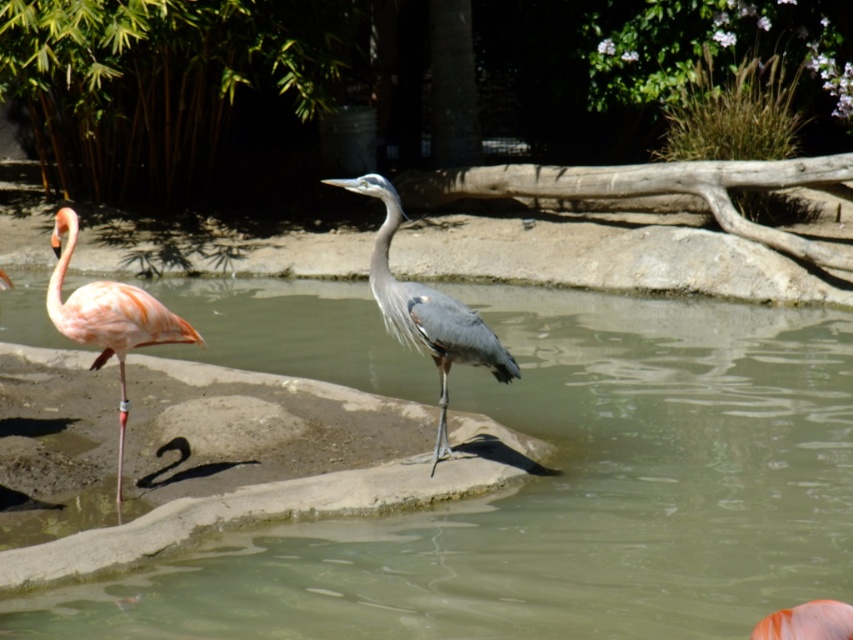
Question: Estimate the real-world distances between objects in this image. Which object is closer to the greenish water at center?

Choices:
 (A) gray matte heron at center
 (B) pink feathered flamingo at left

Answer: (A)

Question: Does gray matte heron at center appear under pink feathered flamingo at left?

Choices:
 (A) no
 (B) yes

Answer: (A)

Question: Which of these objects is positioned farthest from the gray matte heron at center?

Choices:
 (A) pink feathered flamingo at left
 (B) greenish water at center

Answer: (B)

Question: Which point appears farthest from the camera in this image?

Choices:
 (A) (16, 330)
 (B) (108, 321)

Answer: (A)

Question: Is gray matte heron at center bigger than pink feathered flamingo at left?

Choices:
 (A) yes
 (B) no

Answer: (A)

Question: Does greenish water at center appear on the left side of gray matte heron at center?

Choices:
 (A) no
 (B) yes

Answer: (A)